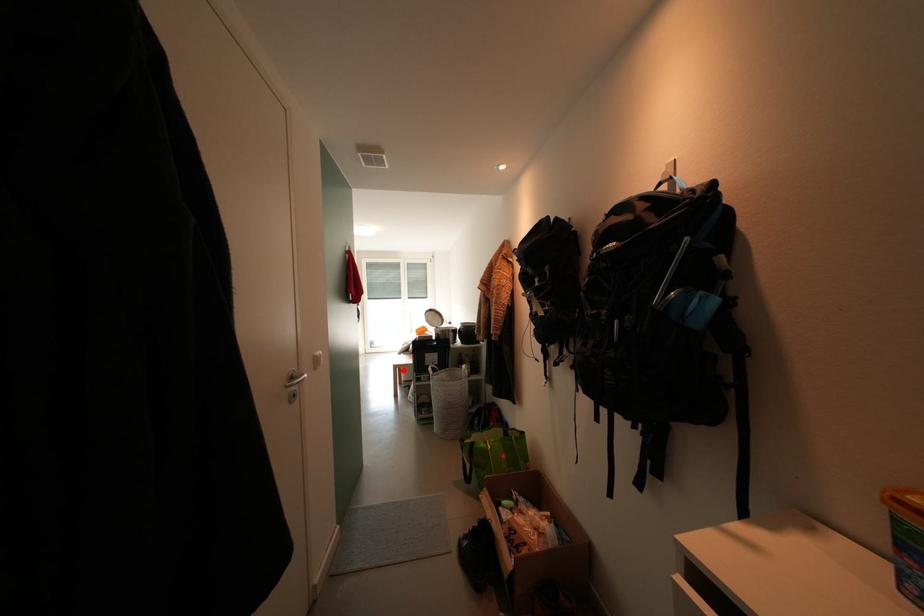
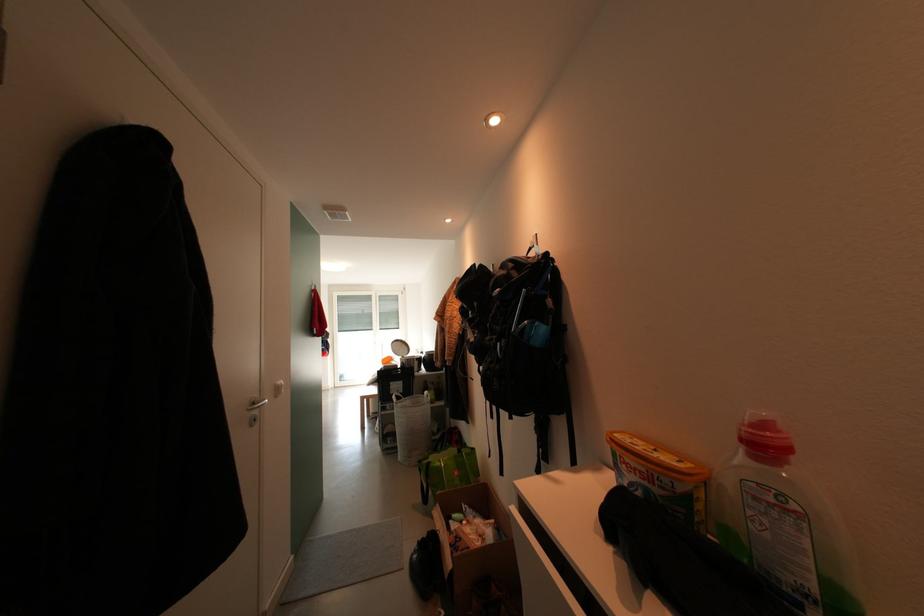
Question: I am providing you with two images of the same scene from different viewpoints. A red point is marked on the first image. Is the red point's position out of view in image 2?

Choices:
 (A) Yes
 (B) No

Answer: (B)